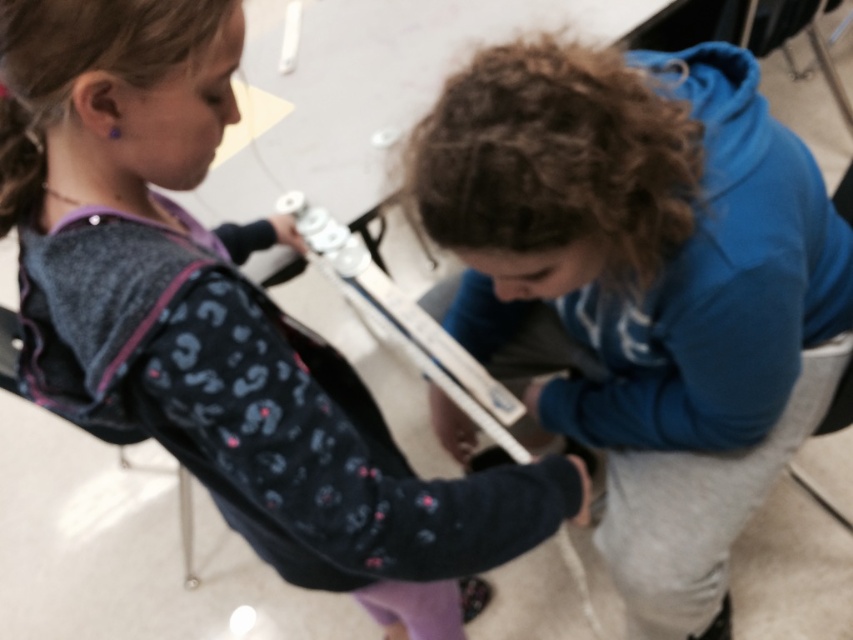
You are standing at the edge of the table and need to place a small item at point (643, 285). What object is already at that location?

The blue fleece hoodie at center is already located at point (643, 285).

You are standing in front of the table where the blue fleece hoodie at center is placed. If you want to reach the hoodie, which direction should you move relative to your current position?

The blue fleece hoodie at center is located at point 0.448 on the x and 0.756 on the y axis. Since the coordinates are relative to the image, you would need to move towards the lower right direction to reach it.